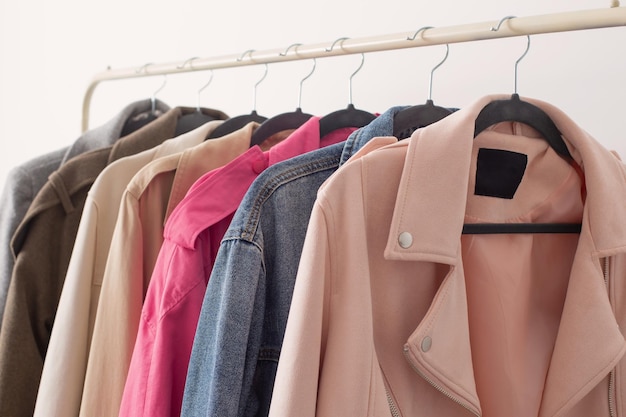
Identify the location of silver hooks. (503, 22), (419, 33), (337, 44), (290, 46), (245, 54), (188, 66), (146, 62).